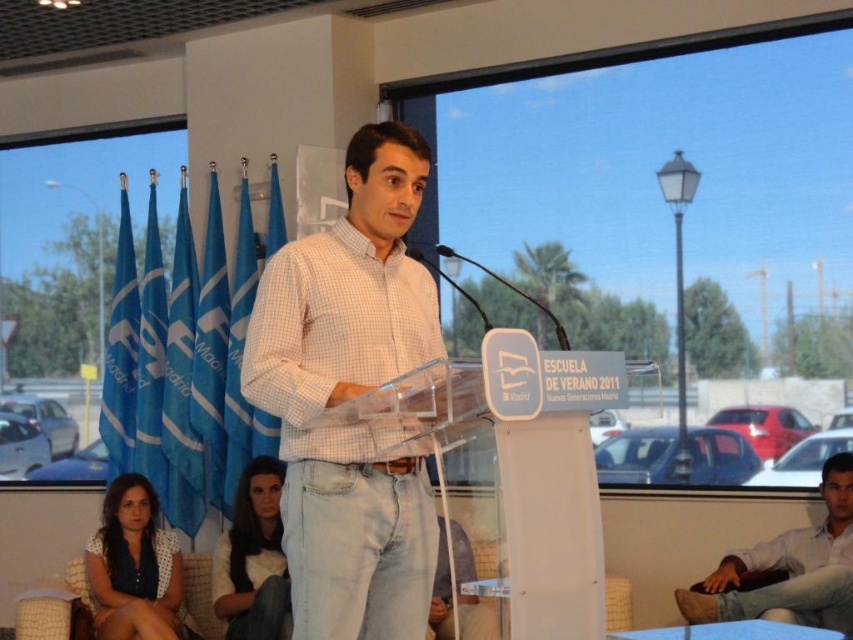
Question: Is white checkered shirt at center further to the viewer compared to light brown leather pants at lower right?

Choices:
 (A) yes
 (B) no

Answer: (B)

Question: Which point is closer to the camera?

Choices:
 (A) light brown leather pants at lower right
 (B) white checkered shirt at center

Answer: (B)

Question: Can you confirm if white checkered shirt at center is positioned to the right of light brown leather pants at lower right?

Choices:
 (A) yes
 (B) no

Answer: (B)

Question: Is white checkered shirt at center further to camera compared to light brown leather pants at lower right?

Choices:
 (A) yes
 (B) no

Answer: (B)

Question: Among these objects, which one is nearest to the camera?

Choices:
 (A) light brown leather pants at lower right
 (B) white checkered shirt at center

Answer: (B)